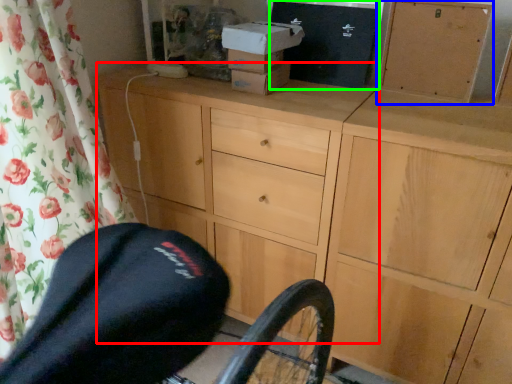
Question: Estimate the real-world distances between objects in this image. Which object is farther from chest of drawers (highlighted by a red box), cabinetry (highlighted by a blue box) or box (highlighted by a green box)?

Choices:
 (A) cabinetry
 (B) box

Answer: (A)